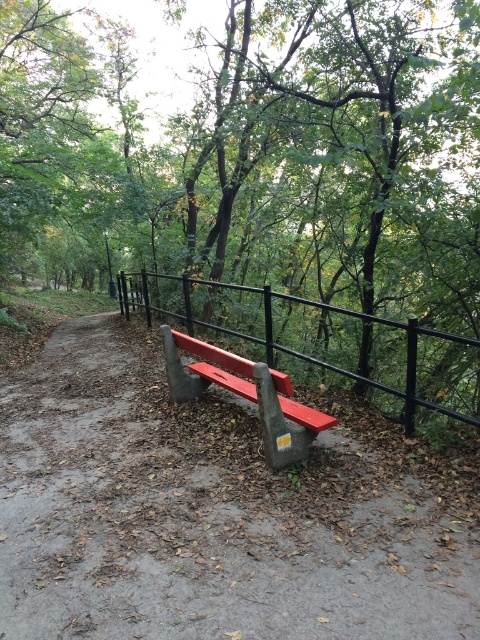
Question: Which object is closer to the camera taking this photo?

Choices:
 (A) concrete bench at center
 (B) smooth red bench at center

Answer: (A)

Question: Which object is positioned farthest from the concrete bench at center?

Choices:
 (A) smooth red bench at center
 (B) smooth metal bench at center
 (C) green leafy tree at center

Answer: (C)

Question: Based on their relative distances, which object is farther from the green leafy tree at center?

Choices:
 (A) smooth red bench at center
 (B) smooth metal bench at center

Answer: (B)

Question: Can you confirm if green leafy tree at center is wider than concrete bench at center?

Choices:
 (A) no
 (B) yes

Answer: (B)

Question: Can you confirm if concrete bench at center is positioned to the left of smooth metal bench at center?

Choices:
 (A) yes
 (B) no

Answer: (A)

Question: Can you confirm if green leafy tree at center is smaller than concrete bench at center?

Choices:
 (A) yes
 (B) no

Answer: (B)